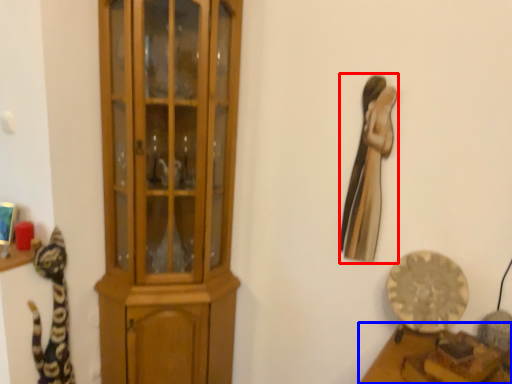
Question: Which point is closer to the camera, animal (highlighted by a red box) or furniture (highlighted by a blue box)?

Choices:
 (A) animal
 (B) furniture

Answer: (B)